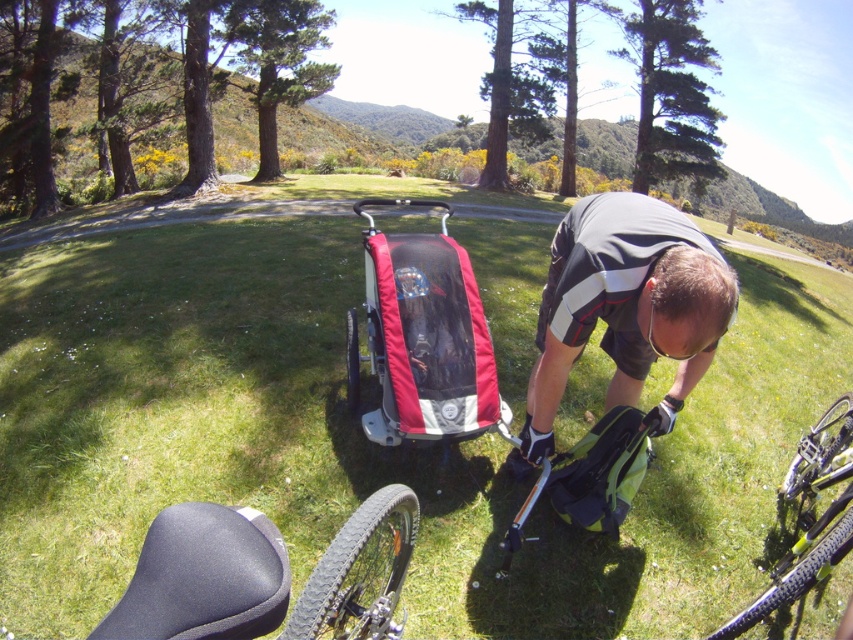
Does black matte seat at lower left have a lesser width compared to red fabric baby carriage at center?

Yes, black matte seat at lower left is thinner than red fabric baby carriage at center.

Is point (259, 624) farther from camera compared to point (393, 305)?

No, it is not.

I want to click on black matte seat at lower left, so click(x=204, y=577).

Can you confirm if dark gray fabric shirt at center is positioned above black matte seat at lower left?

Yes.

Between dark gray fabric shirt at center and black matte seat at lower left, which one appears on the right side from the viewer's perspective?

dark gray fabric shirt at center is more to the right.

Is point (703, 256) less distant than point (138, 609)?

That is False.

You are a GUI agent. You are given a task and a screenshot of the screen. Output one action in this format:
    pyautogui.click(x=<x>, y=<y>)
    Task: Click on the dark gray fabric shirt at center
    
    Given the screenshot: What is the action you would take?
    pyautogui.click(x=625, y=307)

Can you confirm if green grass at center is taller than red fabric baby carriage at center?

Indeed, green grass at center has a greater height compared to red fabric baby carriage at center.

Identify the location of green grass at center. (358, 426).

Where is `green grass at center`? Image resolution: width=853 pixels, height=640 pixels. green grass at center is located at coordinates tap(358, 426).